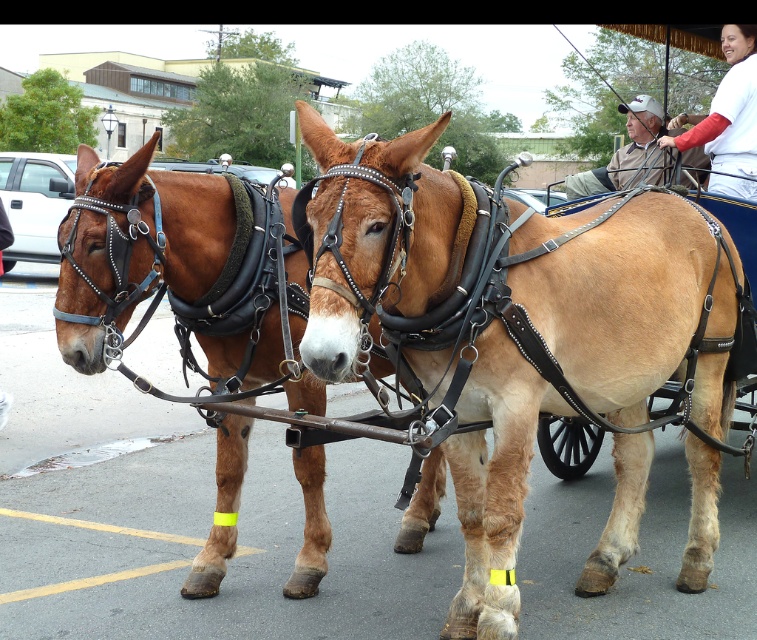
Which is in front, point (357, 188) or point (182, 188)?

Point (357, 188) is in front.

Based on the photo, between light brown leather harness at center and brown leather harness at left, which one is positioned higher?

light brown leather harness at center

Who is more forward, (615, 554) or (192, 577)?

Positioned in front is point (192, 577).

Identify the location of light brown leather harness at center. (628, 300).

Is point (653, 385) closer to viewer compared to point (749, 104)?

Yes, point (653, 385) is closer to viewer.

Describe the element at coordinates (628, 300) in the screenshot. I see `light brown leather harness at center` at that location.

Describe the element at coordinates (628, 300) in the screenshot. The image size is (757, 640). I see `light brown leather harness at center` at that location.

Where is `light brown leather harness at center`? light brown leather harness at center is located at coordinates (628, 300).

Which is behind, point (95, 356) or point (709, 136)?

The point (709, 136) is behind.

Can you confirm if brown leather harness at left is taller than white cotton shirt at upper right?

Correct, brown leather harness at left is much taller as white cotton shirt at upper right.

Between point (217, 468) and point (749, 157), which one is positioned behind?

Positioned behind is point (749, 157).

At what (x,y) coordinates should I click in order to perform the action: click on brown leather harness at left. Please return your answer as a coordinate pair (x, y). The image size is (757, 640). Looking at the image, I should click on (142, 234).